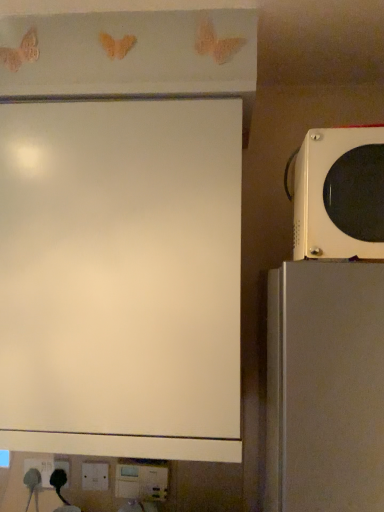
Question: Is white plastic electric outlet at lower left further to the viewer compared to white matte board at upper left?

Choices:
 (A) yes
 (B) no

Answer: (A)

Question: From a real-world perspective, is white plastic electric outlet at lower left beneath white matte board at upper left?

Choices:
 (A) yes
 (B) no

Answer: (A)

Question: From the image's perspective, is white plastic electric outlet at lower left below white matte board at upper left?

Choices:
 (A) yes
 (B) no

Answer: (A)

Question: Does white plastic electric outlet at lower left have a lesser width compared to white matte board at upper left?

Choices:
 (A) no
 (B) yes

Answer: (B)

Question: Is white plastic electric outlet at lower left at the left side of white matte board at upper left?

Choices:
 (A) no
 (B) yes

Answer: (B)

Question: Considering their positions, is white plastic electric outlet at lower left located in front of or behind white matte board at upper left?

Choices:
 (A) behind
 (B) front

Answer: (A)

Question: From a real-world perspective, is white plastic electric outlet at lower left positioned above or below white matte board at upper left?

Choices:
 (A) below
 (B) above

Answer: (A)

Question: Based on their positions, is white plastic electric outlet at lower left located to the left or right of white matte board at upper left?

Choices:
 (A) left
 (B) right

Answer: (A)

Question: Considering the positions of white plastic electric outlet at lower left and white matte board at upper left in the image, is white plastic electric outlet at lower left bigger or smaller than white matte board at upper left?

Choices:
 (A) big
 (B) small

Answer: (B)

Question: Considering the positions of white plastic electric outlet at lower left and white glossy microwave at right in the image, is white plastic electric outlet at lower left bigger or smaller than white glossy microwave at right?

Choices:
 (A) big
 (B) small

Answer: (B)

Question: From a real-world perspective, is white plastic electric outlet at lower left physically located above or below white glossy microwave at right?

Choices:
 (A) above
 (B) below

Answer: (B)

Question: Is white plastic electric outlet at lower left in front of or behind white glossy microwave at right in the image?

Choices:
 (A) behind
 (B) front

Answer: (A)

Question: In terms of height, does white plastic electric outlet at lower left look taller or shorter compared to white glossy microwave at right?

Choices:
 (A) short
 (B) tall

Answer: (A)

Question: Considering the positions of white glossy microwave at right and white matte board at upper left in the image, is white glossy microwave at right bigger or smaller than white matte board at upper left?

Choices:
 (A) big
 (B) small

Answer: (B)

Question: From the image's perspective, is white glossy microwave at right located above or below white matte board at upper left?

Choices:
 (A) below
 (B) above

Answer: (B)